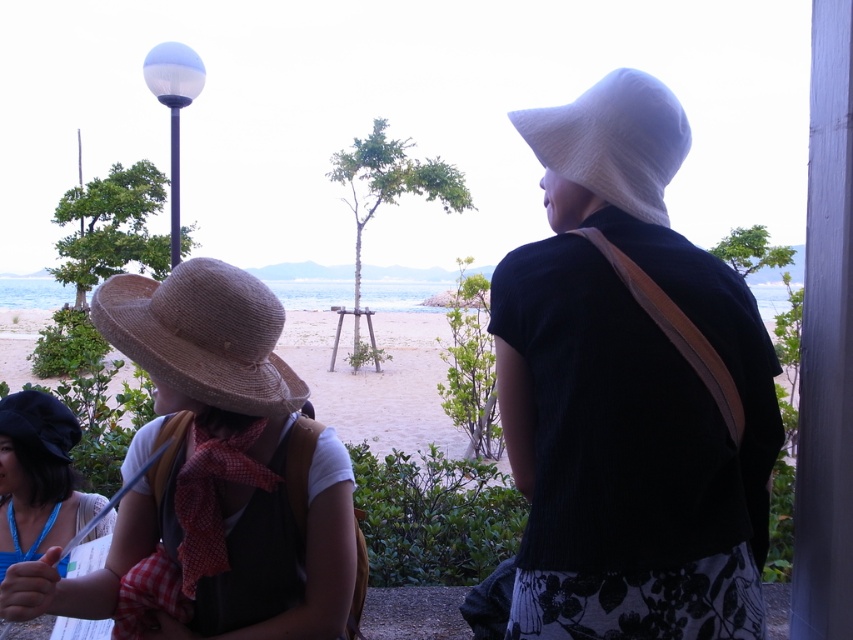
You are standing on the veranda and want to identify which hat is taller between the white woven hat at upper right and the white straw hat at upper right. Which one is taller?

The white woven hat at upper right is taller than the white straw hat at upper right according to the description.

You are a photographer trying to capture a clear shot of both the white woven hat at upper right and the white straw hat at upper right. Since they are both at the same position, which hat will appear bigger in your photo?

The white woven hat at upper right will appear bigger in your photo because it is larger in size than the white straw hat at upper right.